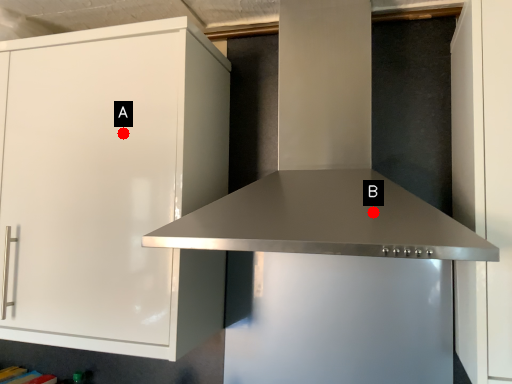
Question: Two points are circled on the image, labeled by A and B beside each circle. Which point is farther from the camera taking this photo?

Choices:
 (A) A is further
 (B) B is further

Answer: (A)